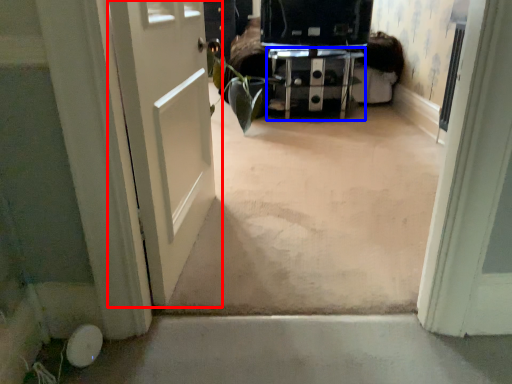
Question: Which point is closer to the camera, door (highlighted by a red box) or furniture (highlighted by a blue box)?

Choices:
 (A) door
 (B) furniture

Answer: (A)